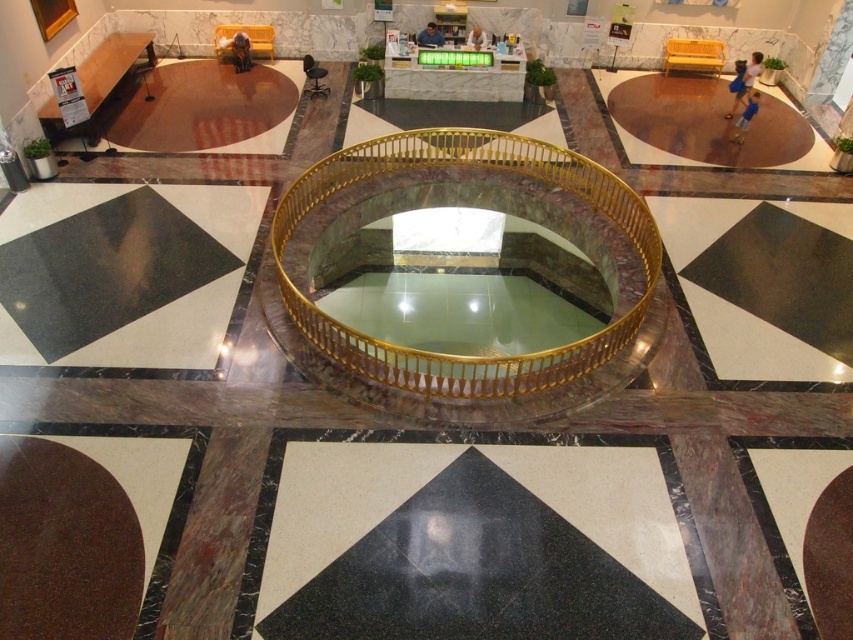
Question: Based on their relative distances, which object is nearer to the brown polished stone circle at lower left?

Choices:
 (A) brown polished stone atrium at upper left
 (B) black marble floor at lower right
 (C) brown polished wood floor at upper right
 (D) black marble atrium at lower left

Answer: (D)

Question: Which is farther from the brown polished stone circle at lower left?

Choices:
 (A) brown polished wood floor at upper right
 (B) black marble atrium at lower center
 (C) black marble floor at lower right

Answer: (A)

Question: Does brown polished wood floor at upper right have a greater width compared to brown polished stone circle at lower left?

Choices:
 (A) yes
 (B) no

Answer: (A)

Question: Can you confirm if black marble atrium at lower left is positioned below brown polished wood floor at upper right?

Choices:
 (A) yes
 (B) no

Answer: (A)

Question: Is brown polished wood floor at upper right to the right of brown polished stone circle at lower left from the viewer's perspective?

Choices:
 (A) yes
 (B) no

Answer: (A)

Question: Which of these objects is positioned farthest from the black marble atrium at lower center?

Choices:
 (A) brown polished stone atrium at upper left
 (B) black marble atrium at lower left
 (C) brown polished stone circle at lower left
 (D) brown polished wood floor at upper right

Answer: (A)